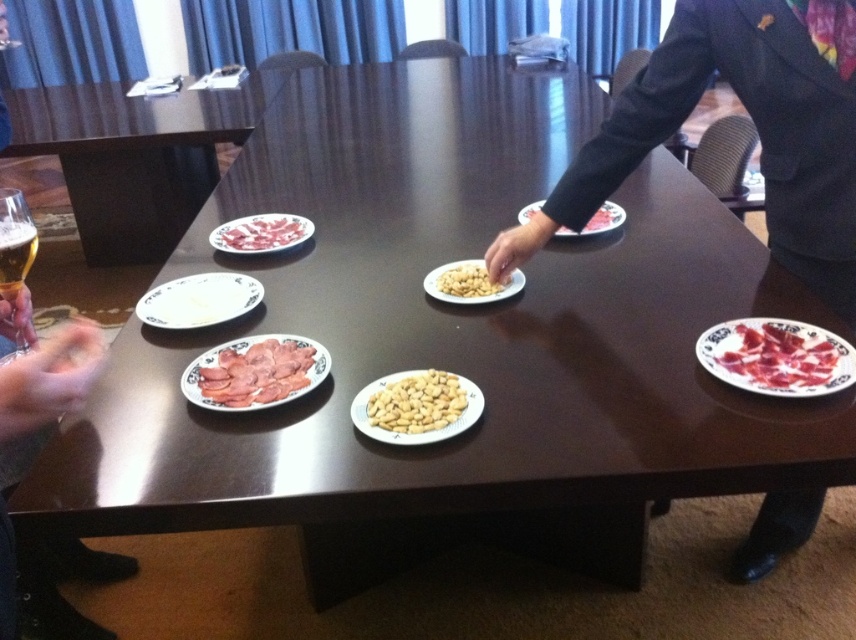
Based on the photo, between pink glossy meat at center and translucent glass beer at left, which one appears on the left side from the viewer's perspective?

translucent glass beer at left

Between point (260, 388) and point (10, 220), which one is positioned behind?

Positioned behind is point (260, 388).

Who is more distant from viewer, [314,349] or [22,224]?

The point [314,349] is behind.

Locate an element on the screen. The width and height of the screenshot is (856, 640). pink glossy meat at center is located at coordinates (257, 372).

Between sliced pink meat at upper left and translucent glass beer at left, which one has less height?

sliced pink meat at upper left is shorter.

Is sliced pink meat at upper left thinner than translucent glass beer at left?

No, sliced pink meat at upper left is not thinner than translucent glass beer at left.

Identify the location of sliced pink meat at upper left. The height and width of the screenshot is (640, 856). (260, 234).

At what (x,y) coordinates should I click in order to perform the action: click on sliced pink meat at upper left. Please return your answer as a coordinate pair (x, y). The height and width of the screenshot is (640, 856). Looking at the image, I should click on (260, 234).

Is point (235, 376) farther from viewer compared to point (452, 285)?

No, it is in front of (452, 285).

Who is shorter, pink glossy meat at center or yellow matte peanuts at center?

yellow matte peanuts at center

This screenshot has height=640, width=856. What do you see at coordinates (257, 372) in the screenshot? I see `pink glossy meat at center` at bounding box center [257, 372].

In order to click on pink glossy meat at center in this screenshot , I will do `click(257, 372)`.